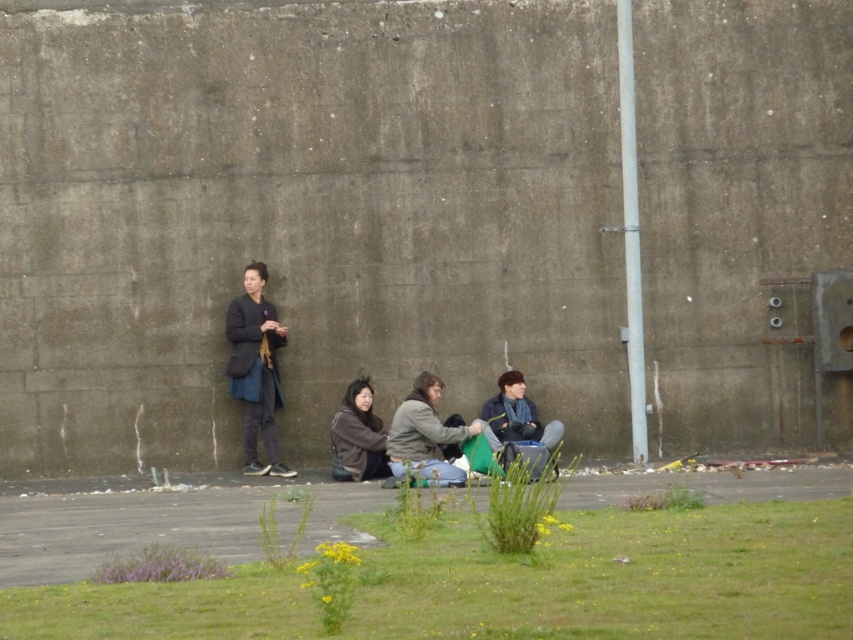
The image size is (853, 640). Identify the location of dark blue fabric coat at center. (254, 369).

Image resolution: width=853 pixels, height=640 pixels. What do you see at coordinates (254, 369) in the screenshot? I see `dark blue fabric coat at center` at bounding box center [254, 369].

You are a GUI agent. You are given a task and a screenshot of the screen. Output one action in this format:
    pyautogui.click(x=<x>, y=<y>)
    Task: Click on the dark blue fabric coat at center
    This screenshot has width=853, height=640.
    Given the screenshot: What is the action you would take?
    pyautogui.click(x=254, y=369)

Can you confirm if dark blue fabric coat at center is positioned to the left of brown fuzzy jacket at lower center?

Indeed, dark blue fabric coat at center is positioned on the left side of brown fuzzy jacket at lower center.

Which is below, dark blue fabric coat at center or brown fuzzy jacket at lower center?

brown fuzzy jacket at lower center is lower down.

Between point (244, 294) and point (341, 433), which one is positioned in front?

Point (341, 433) is more forward.

The height and width of the screenshot is (640, 853). I want to click on dark blue fabric coat at center, so click(x=254, y=369).

Who is positioned more to the left, gray concrete wall at center or dark blue jacket at center?

dark blue jacket at center

Based on the photo, measure the distance between gray concrete wall at center and camera.

gray concrete wall at center is 16.81 meters from camera.

The width and height of the screenshot is (853, 640). Find the location of `gray concrete wall at center`. gray concrete wall at center is located at coordinates coord(302,216).